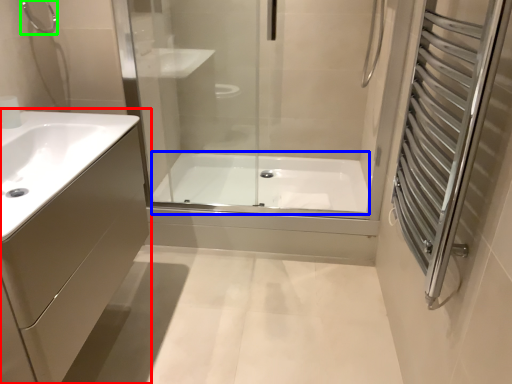
Question: Based on their relative distances, which object is farther from bathroom cabinet (highlighted by a red box)? Choose from bath (highlighted by a blue box) and shower (highlighted by a green box).

Choices:
 (A) bath
 (B) shower

Answer: (A)